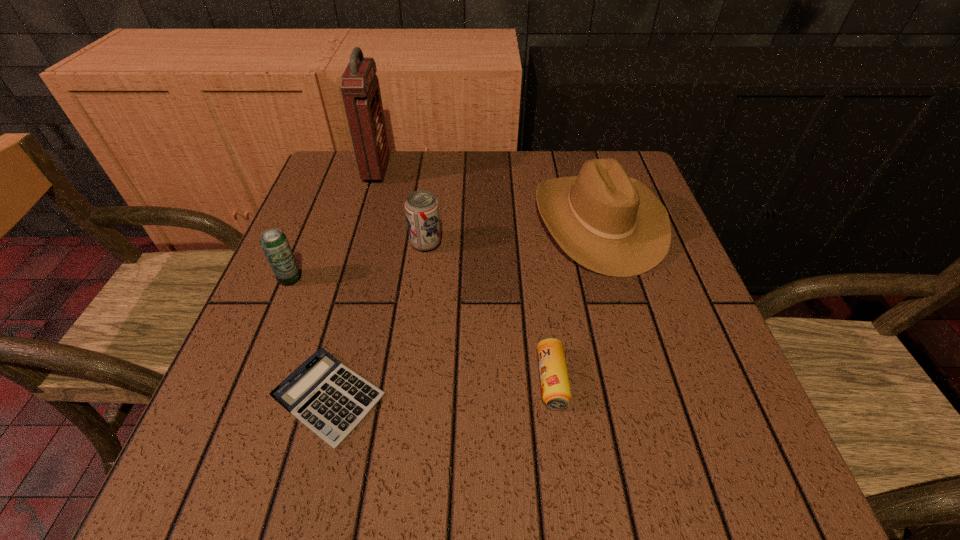
You are a GUI agent. You are given a task and a screenshot of the screen. Output one action in this format:
    pyautogui.click(x=<x>, y=<y>)
    Task: Click on the tallest object
    This screenshot has width=960, height=540.
    Given the screenshot: What is the action you would take?
    pyautogui.click(x=359, y=84)

In order to click on cowboy hat in this screenshot , I will do `click(610, 223)`.

Find the location of `the second beer can from right to left`. the second beer can from right to left is located at coordinates (421, 207).

Identify the location of the leftmost beer can. The image size is (960, 540). (274, 243).

The height and width of the screenshot is (540, 960). Identify the location of the leftmost object. (274, 243).

Identify the location of the nearest beer can. The height and width of the screenshot is (540, 960). (556, 394).

This screenshot has height=540, width=960. Find the location of `the rightmost beer can`. the rightmost beer can is located at coordinates (556, 394).

Find the location of `the shortest object`. the shortest object is located at coordinates (330, 399).

At what (x,y) coordinates should I click in order to perform the action: click on vacant space located 0.370m on the front-facing side of the first-aid kit. Please return your answer as a coordinate pair (x, y). Looking at the image, I should click on (529, 170).

This screenshot has height=540, width=960. What are the coordinates of `vacant area situated 0.160m on the front of the cowboy hat` in the screenshot? It's located at (635, 344).